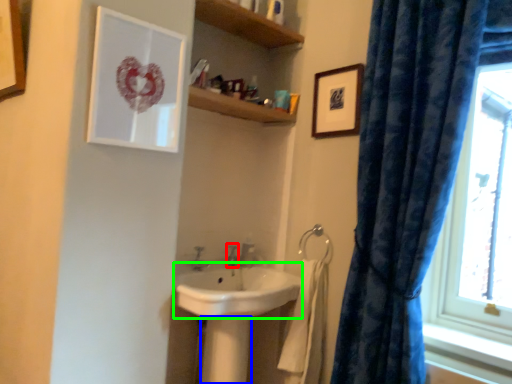
Question: Which is farther away from plumbing fixture (highlighted by a red box)? pillar (highlighted by a blue box) or sink (highlighted by a green box)?

Choices:
 (A) pillar
 (B) sink

Answer: (A)